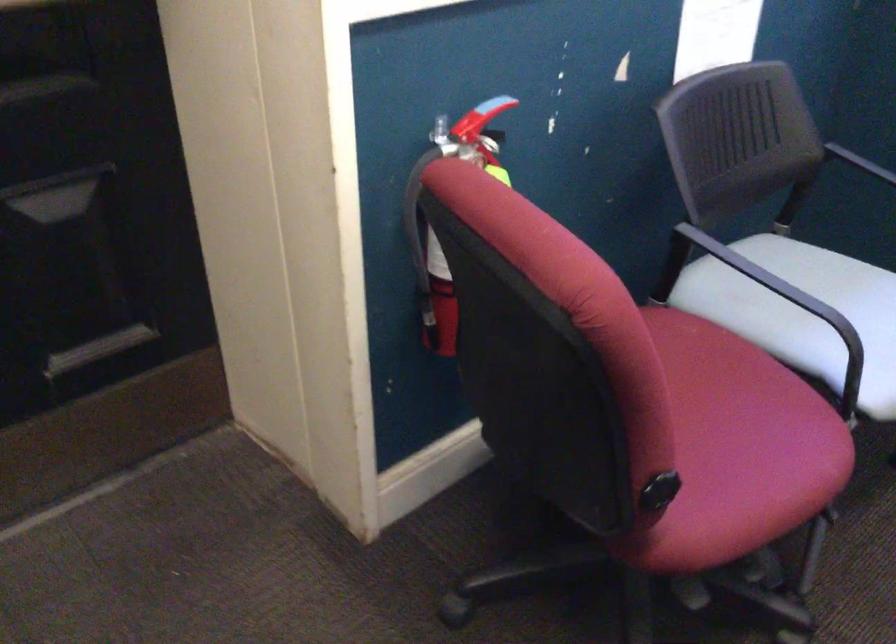
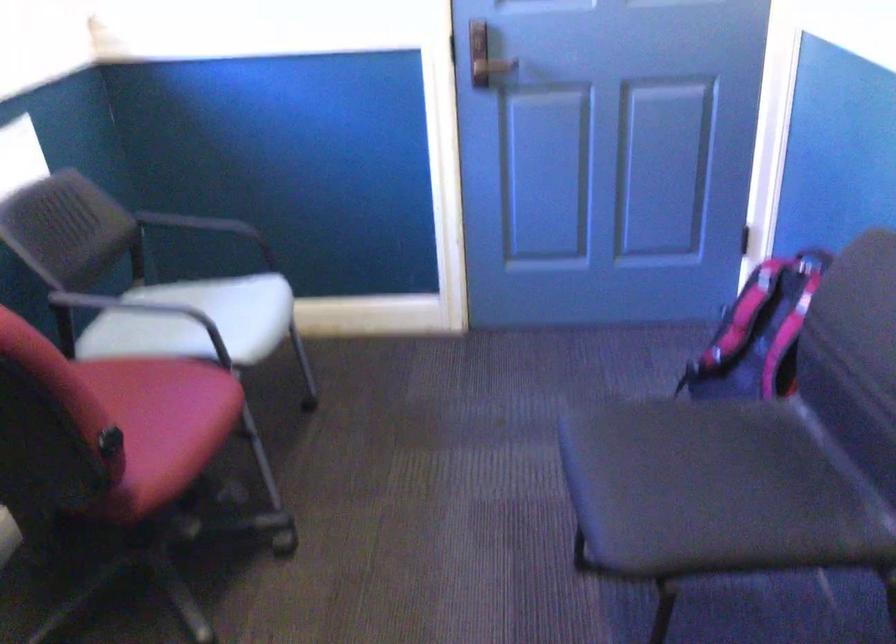
Question: I am providing you with two images of the same scene from different viewpoints. After the viewpoint changes to image2, which objects are now occluded?

Choices:
 (A) blue dispenser bottle
 (B) black chair armrest
 (C) door handle
 (D) pink and black backpack

Answer: (B)